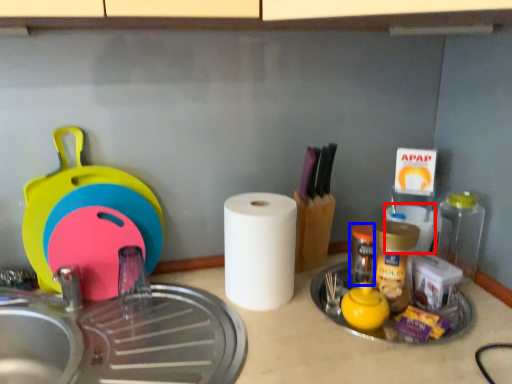
Question: Which object is further to the camera taking this photo, paper towel (highlighted by a red box) or bottle (highlighted by a blue box)?

Choices:
 (A) paper towel
 (B) bottle

Answer: (A)